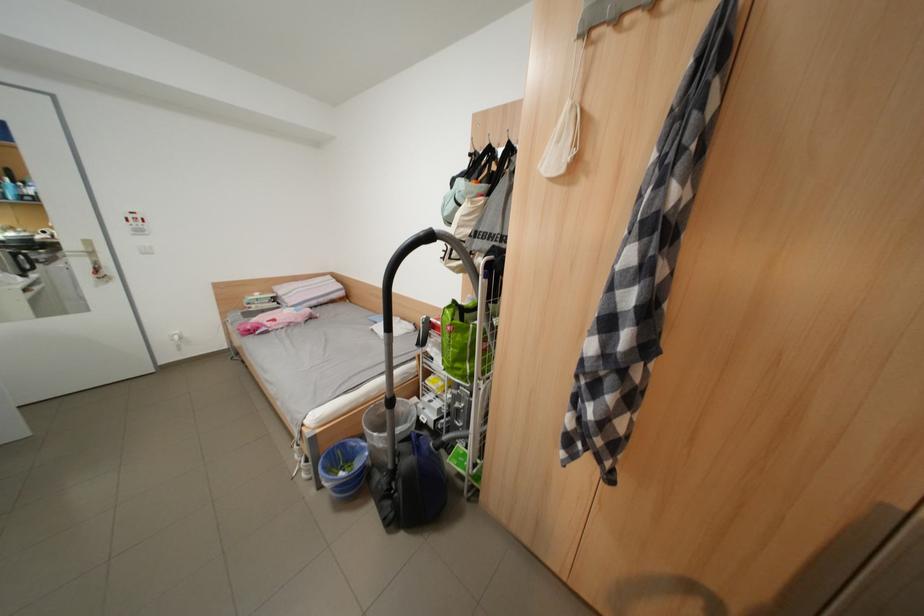
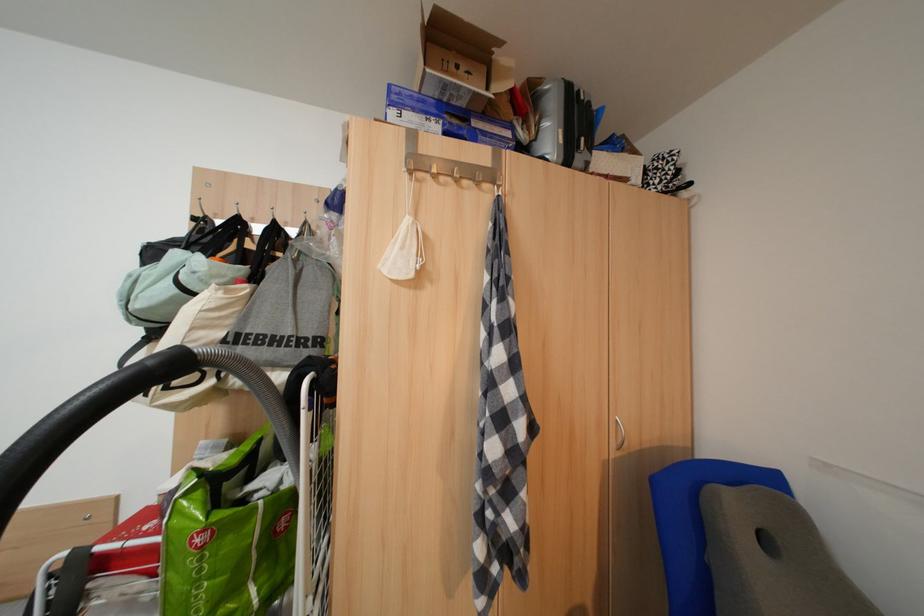
Question: The camera is either moving clockwise (left) or counter-clockwise (right) around the object. The first image is from the beginning of the video and the second image is from the end. Is the camera moving left or right when shooting the video?

Choices:
 (A) Left
 (B) Right

Answer: (A)